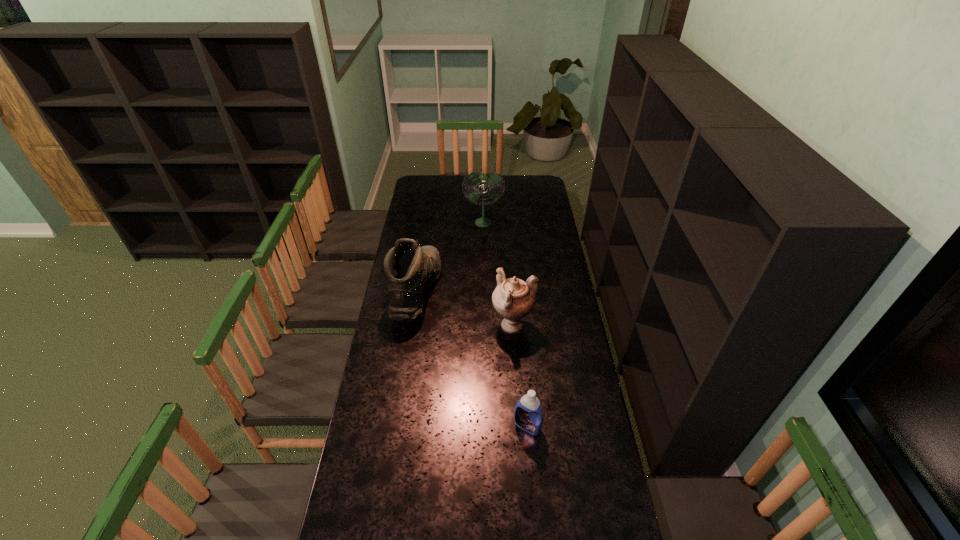
Find the location of `fan`. fan is located at coordinates (483, 183).

You are a GUI agent. You are given a task and a screenshot of the screen. Output one action in this format:
    pyautogui.click(x=<x>, y=<y>)
    Task: Click on the ski boot
    The width and height of the screenshot is (960, 540).
    Given the screenshot: What is the action you would take?
    pyautogui.click(x=409, y=269)

Where is `urn`? This screenshot has height=540, width=960. urn is located at coordinates (513, 299).

The height and width of the screenshot is (540, 960). In order to click on detergent in this screenshot , I will do `click(528, 415)`.

At what (x,y) coordinates should I click in order to perform the action: click on the shortest object. Please return your answer as a coordinate pair (x, y). The height and width of the screenshot is (540, 960). Looking at the image, I should click on (528, 415).

Locate an element on the screen. The height and width of the screenshot is (540, 960). free region located 0.240m on the front-facing side of the farthest object is located at coordinates (484, 257).

Locate an element on the screen. The width and height of the screenshot is (960, 540). vacant area situated 0.150m on the right of the leftmost object is located at coordinates (471, 292).

Find the location of `vacant point located on the left of the urn`. vacant point located on the left of the urn is located at coordinates (470, 327).

In order to click on vacant space located on the left of the shortest object in this screenshot , I will do `click(441, 426)`.

Where is `object present at the left edge`? This screenshot has width=960, height=540. object present at the left edge is located at coordinates (409, 269).